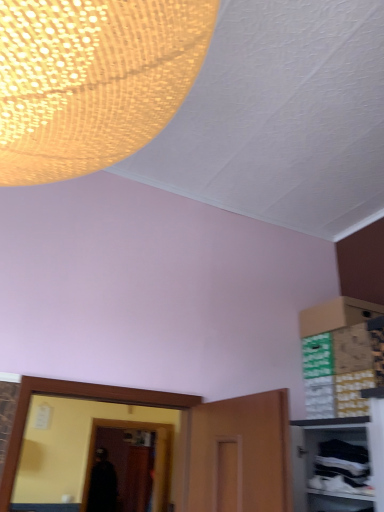
Question: Is point (342, 423) positioned closer to the camera than point (160, 504)?

Choices:
 (A) closer
 (B) farther

Answer: (A)

Question: From the image's perspective, relative to transparent glass door at center, is white fabric cabinet at lower right above or below?

Choices:
 (A) below
 (B) above

Answer: (B)

Question: In terms of width, does white fabric cabinet at lower right look wider or thinner when compared to transparent glass door at center?

Choices:
 (A) wide
 (B) thin

Answer: (A)

Question: From a real-world perspective, relative to white fabric cabinet at lower right, is transparent glass door at center vertically above or below?

Choices:
 (A) above
 (B) below

Answer: (B)

Question: Considering the positions of point (157, 422) and point (291, 471), is point (157, 422) closer or farther from the camera than point (291, 471)?

Choices:
 (A) farther
 (B) closer

Answer: (A)

Question: From the image's perspective, relative to white fabric cabinet at lower right, is transparent glass door at center above or below?

Choices:
 (A) below
 (B) above

Answer: (A)

Question: Considering the positions of transparent glass door at center and white fabric cabinet at lower right in the image, is transparent glass door at center wider or thinner than white fabric cabinet at lower right?

Choices:
 (A) thin
 (B) wide

Answer: (A)